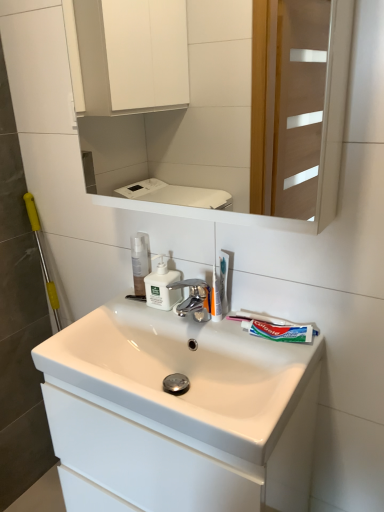
In order to click on vacant space in front of translucent plastic toothbrush at center in this screenshot , I will do `click(248, 345)`.